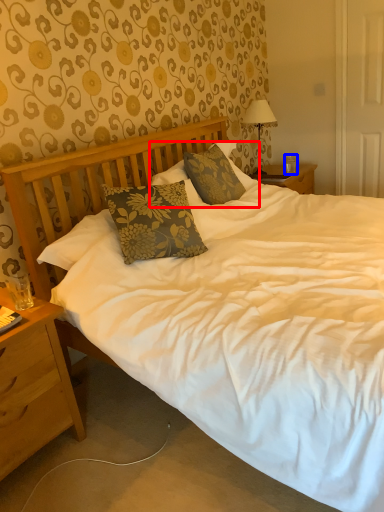
Question: Among these objects, which one is farthest to the camera, pillow (highlighted by a red box) or coffee cup (highlighted by a blue box)?

Choices:
 (A) pillow
 (B) coffee cup

Answer: (B)